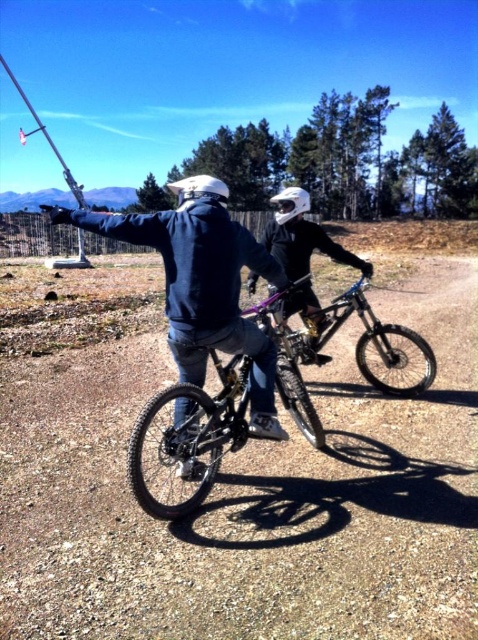
Who is positioned more to the left, shiny black bicycle at center or shiny black helmet at center?

From the viewer's perspective, shiny black bicycle at center appears more on the left side.

Between point (304, 416) and point (315, 320), which one is positioned in front?

Positioned in front is point (304, 416).

Where is `shiny black bicycle at center`? The image size is (478, 640). shiny black bicycle at center is located at coordinates (193, 435).

Does dirt track at center appear under shiny black bicycle at center?

No.

Who is lower down, dirt track at center or shiny black bicycle at center?

shiny black bicycle at center is below.

Is point (432, 492) positioned behind point (173, 394)?

Yes, it is behind point (173, 394).

Where is `dirt track at center`? dirt track at center is located at coordinates (249, 499).

Is shiny metallic bicycle at center wider than shiny black helmet at center?

In fact, shiny metallic bicycle at center might be narrower than shiny black helmet at center.

Does shiny metallic bicycle at center lie in front of shiny black helmet at center?

No, it is not.

This screenshot has height=640, width=478. Describe the element at coordinates (357, 340) in the screenshot. I see `shiny metallic bicycle at center` at that location.

At what (x,y) coordinates should I click in order to perform the action: click on shiny metallic bicycle at center. Please return your answer as a coordinate pair (x, y). Looking at the image, I should click on (357, 340).